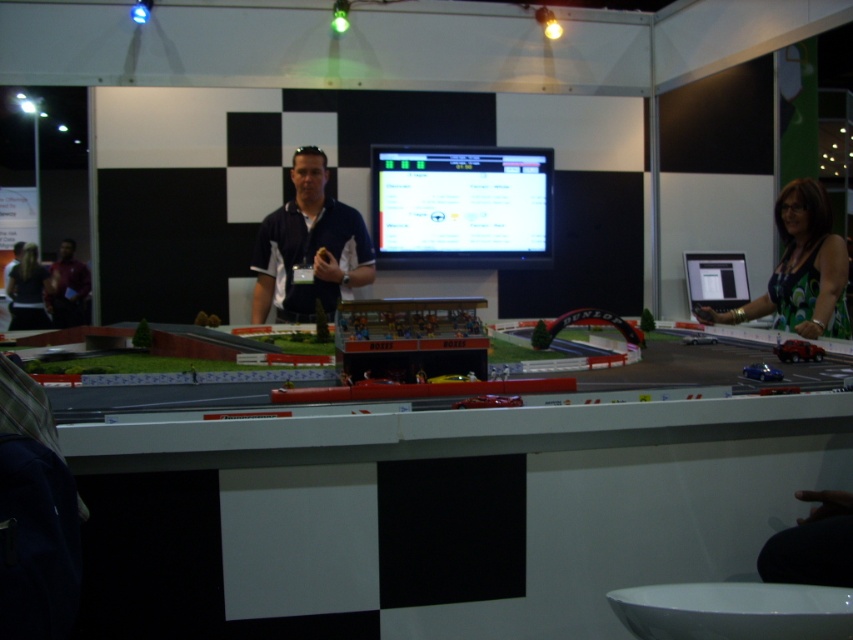
Does point (338, 438) lie in front of point (48, 278)?

Yes.

Is point (515, 490) positioned after point (28, 285)?

No, (515, 490) is in front of (28, 285).

Does point (268, 456) lie behind point (45, 275)?

No, (268, 456) is closer to viewer.

This screenshot has height=640, width=853. Identify the location of white glossy table at center. [x=437, y=513].

Does white glossy table at center come in front of matte black shirt at left?

Yes.

Is point (397, 612) positioned behind point (73, 310)?

No, (397, 612) is closer to viewer.

This screenshot has height=640, width=853. Find the location of `white glossy table at center`. white glossy table at center is located at coordinates click(x=437, y=513).

In the scene shown: Is matte black shirt at left closer to camera compared to dark gray shirt at left?

That is False.

Is matte black shirt at left to the right of dark gray shirt at left from the viewer's perspective?

Indeed, matte black shirt at left is positioned on the right side of dark gray shirt at left.

This screenshot has height=640, width=853. I want to click on matte black shirt at left, so click(68, 288).

Identify the location of matte black shirt at left. This screenshot has width=853, height=640. (68, 288).